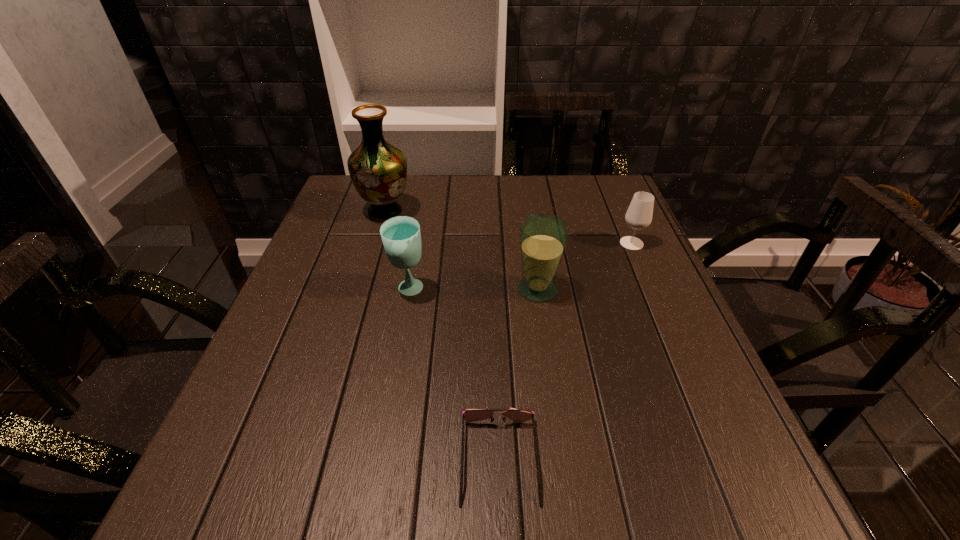
You are a GUI agent. You are given a task and a screenshot of the screen. Output one action in this format:
    pyautogui.click(x=<x>, y=<y>)
    Task: Click on the vacant area that lies between the vase and the second glass from right to left
    This screenshot has width=960, height=540.
    Given the screenshot: What is the action you would take?
    462,251

I want to click on free spot between the rightmost object and the vase, so click(x=509, y=228).

Find the location of a particular element. empty space between the shortest glass and the second glass from right to left is located at coordinates point(585,266).

Locate which object is the fourth closest to the nearest object. Please provide its 2D coordinates. Your answer should be formatted as a tuple, i.e. [(x, y)], where the tuple contains the x and y coordinates of a point satisfying the conditions above.

[(378, 170)]

Find the location of `the closest object to the leftmost glass`. the closest object to the leftmost glass is located at coordinates (543, 237).

This screenshot has height=540, width=960. Find the location of `glass identified as the second closest to the farthest object`. glass identified as the second closest to the farthest object is located at coordinates (543, 237).

Identify which glass is the nearest to the rightmost glass. Please provide its 2D coordinates. Your answer should be formatted as a tuple, i.e. [(x, y)], where the tuple contains the x and y coordinates of a point satisfying the conditions above.

[(543, 237)]

You are a GUI agent. You are given a task and a screenshot of the screen. Output one action in this format:
    pyautogui.click(x=<x>, y=<y>)
    Task: Click on the free space that satisfies the following two spatial constraints: 1. on the front side of the vase; 2. on the right side of the second glass from left to right
    The width and height of the screenshot is (960, 540).
    Given the screenshot: What is the action you would take?
    pyautogui.click(x=363, y=289)